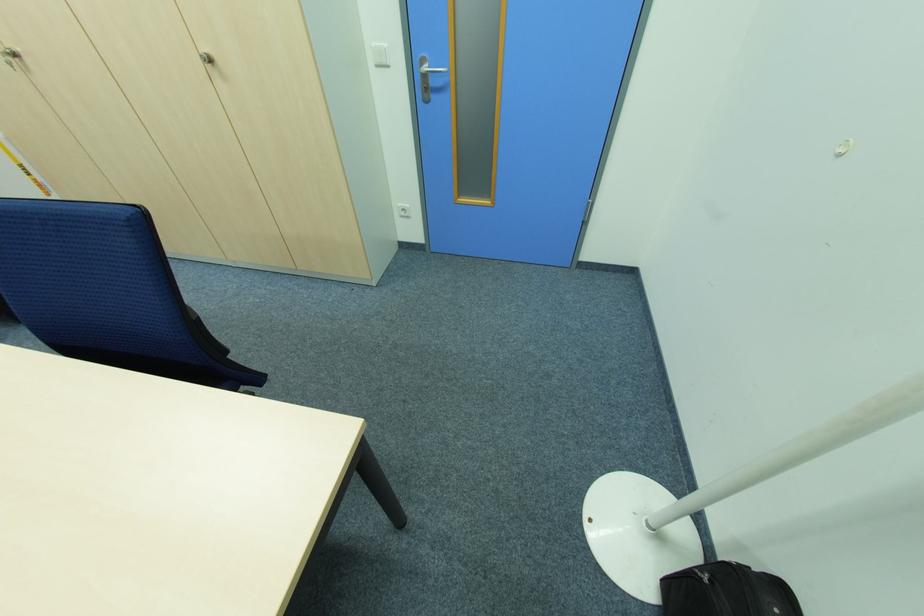
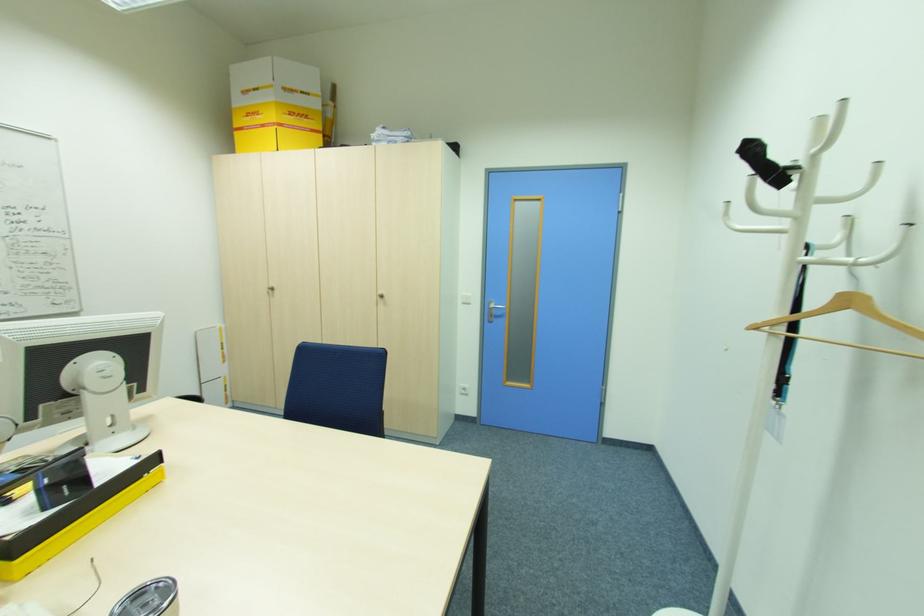
Question: Based on the continuous images, in which direction is the camera rotating? Reply with the corresponding letter.

Choices:
 (A) Left
 (B) Right
 (C) Up
 (D) Down

Answer: (C)